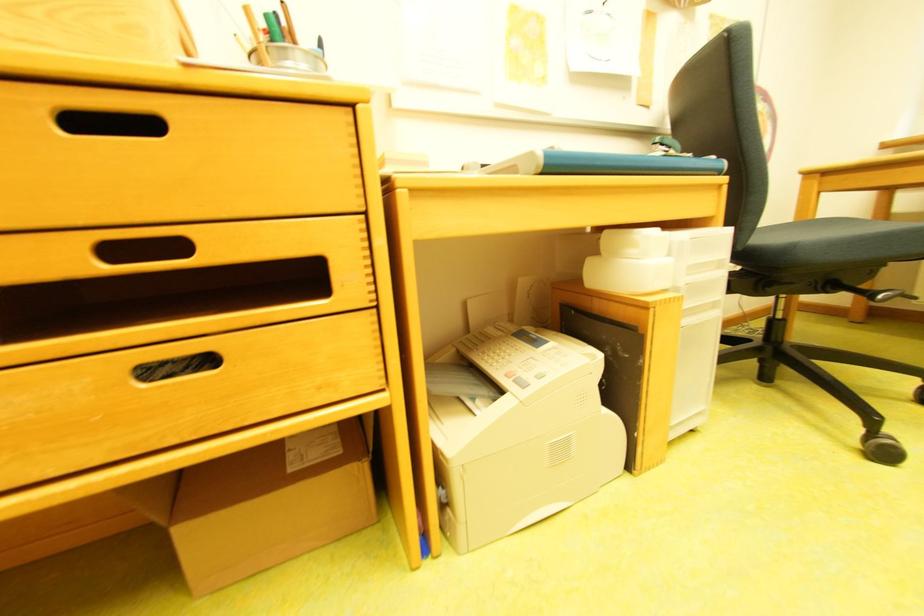
The width and height of the screenshot is (924, 616). Identify the location of fax machine button. (541, 376).